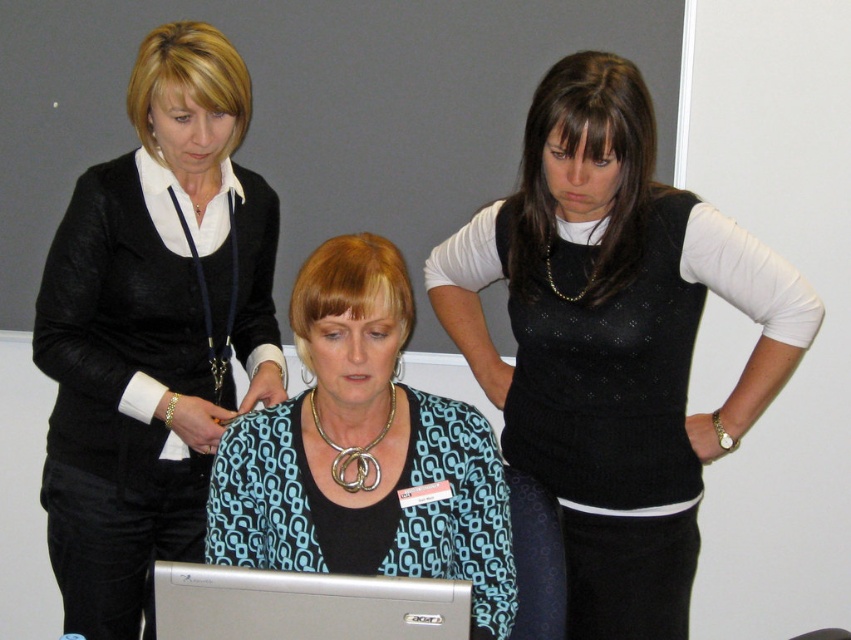
You are a person standing at the location of the viewer. You want to hand a document to the woman wearing the black knitted vest at center without moving your position. Is it possible to reach her?

The black knitted vest at center and viewer are 4.62 feet apart from each other, so it is not possible to reach the woman wearing the black knitted vest at center without moving closer.

Based on the scene, which object, the black knitted vest at center or the black matte blazer at upper left, is shorter in height?

The black knitted vest at center is shorter in height than the black matte blazer at upper left.